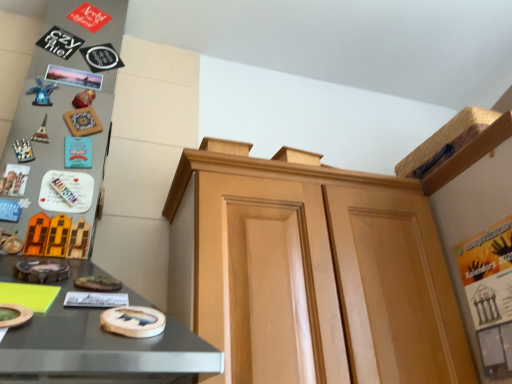
Measure the distance between blue plastic windmill at left and camera.

blue plastic windmill at left is 1.04 meters from camera.

I want to click on blue plastic windmill at left, so click(x=42, y=93).

The image size is (512, 384). What do you see at coordinates (42, 93) in the screenshot? I see `blue plastic windmill at left` at bounding box center [42, 93].

The image size is (512, 384). What do you see at coordinates (316, 272) in the screenshot?
I see `light brown wood cabinet at center` at bounding box center [316, 272].

This screenshot has height=384, width=512. Find the location of `light brown wood cabinet at center`. light brown wood cabinet at center is located at coordinates (316, 272).

Find the location of `blue plastic windmill at left`. blue plastic windmill at left is located at coordinates (42, 93).

Considering the positions of objects blue plastic windmill at left and light brown wood cabinet at center in the image provided, who is more to the left, blue plastic windmill at left or light brown wood cabinet at center?

blue plastic windmill at left.

Considering the relative positions of blue plastic windmill at left and light brown wood cabinet at center in the image provided, is blue plastic windmill at left in front of light brown wood cabinet at center?

No.

Is point (36, 101) closer to viewer compared to point (418, 304)?

No, it is not.

From the image's perspective, would you say blue plastic windmill at left is shown under light brown wood cabinet at center?

No, from the image's perspective, blue plastic windmill at left is not beneath light brown wood cabinet at center.

From a real-world perspective, between blue plastic windmill at left and light brown wood cabinet at center, who is vertically lower?

light brown wood cabinet at center, from a real-world perspective.

Does blue plastic windmill at left have a lesser width compared to light brown wood cabinet at center?

Indeed, blue plastic windmill at left has a lesser width compared to light brown wood cabinet at center.

From their relative heights in the image, would you say blue plastic windmill at left is taller or shorter than light brown wood cabinet at center?

In the image, blue plastic windmill at left appears to be shorter than light brown wood cabinet at center.

Is blue plastic windmill at left bigger than light brown wood cabinet at center?

Incorrect, blue plastic windmill at left is not larger than light brown wood cabinet at center.

Is blue plastic windmill at left inside the boundaries of light brown wood cabinet at center, or outside?

blue plastic windmill at left is located beyond the bounds of light brown wood cabinet at center.

Looking at this image, would you consider blue plastic windmill at left to be distant from light brown wood cabinet at center?

That's not correct — blue plastic windmill at left is a little close to light brown wood cabinet at center.

Is blue plastic windmill at left facing away from light brown wood cabinet at center?

No, blue plastic windmill at left's orientation is not away from light brown wood cabinet at center.

This screenshot has width=512, height=384. What are the coordinates of `toy lying above the light brown wood cabinet at center (from the image's perspective)` in the screenshot? It's located at (42, 93).

Is light brown wood cabinet at center to the right of blue plastic windmill at left from the viewer's perspective?

Yes, light brown wood cabinet at center is to the right of blue plastic windmill at left.

In the image, is light brown wood cabinet at center positioned in front of or behind blue plastic windmill at left?

Visually, light brown wood cabinet at center is located in front of blue plastic windmill at left.

Does point (456, 341) come farther from viewer compared to point (41, 85)?

No.

From the image's perspective, is light brown wood cabinet at center over blue plastic windmill at left?

No.

From a real-world perspective, between light brown wood cabinet at center and blue plastic windmill at left, who is vertically higher?

blue plastic windmill at left is physically above.

Consider the image. Which object is thinner, light brown wood cabinet at center or blue plastic windmill at left?

Thinner between the two is blue plastic windmill at left.

Is light brown wood cabinet at center taller or shorter than blue plastic windmill at left?

In the image, light brown wood cabinet at center appears to be taller than blue plastic windmill at left.

Considering the relative sizes of light brown wood cabinet at center and blue plastic windmill at left in the image provided, is light brown wood cabinet at center bigger than blue plastic windmill at left?

Yes, light brown wood cabinet at center is bigger than blue plastic windmill at left.

Can blue plastic windmill at left be found inside light brown wood cabinet at center?

Actually, blue plastic windmill at left is outside light brown wood cabinet at center.

Is light brown wood cabinet at center far from blue plastic windmill at left?

light brown wood cabinet at center is near blue plastic windmill at left, not far away.

Does light brown wood cabinet at center turn towards blue plastic windmill at left?

No, light brown wood cabinet at center is not oriented towards blue plastic windmill at left.

What's the angular difference between light brown wood cabinet at center and blue plastic windmill at left's facing directions?

They differ by 0.00351 degrees in their facing directions.

Measure the distance from light brown wood cabinet at center to blue plastic windmill at left.

The distance of light brown wood cabinet at center from blue plastic windmill at left is 30.62 inches.

You are a GUI agent. You are given a task and a screenshot of the screen. Output one action in this format:
    pyautogui.click(x=<x>, y=<y>)
    Task: Click on the cabinetry located on the right of blue plastic windmill at left
    Image resolution: width=512 pixels, height=384 pixels.
    Given the screenshot: What is the action you would take?
    pyautogui.click(x=316, y=272)

Where is `toy on the left of light brown wood cabinet at center`? Image resolution: width=512 pixels, height=384 pixels. toy on the left of light brown wood cabinet at center is located at coordinates (42, 93).

Find the location of a particular element. toy positioned vertically above the light brown wood cabinet at center (from a real-world perspective) is located at coordinates (42, 93).